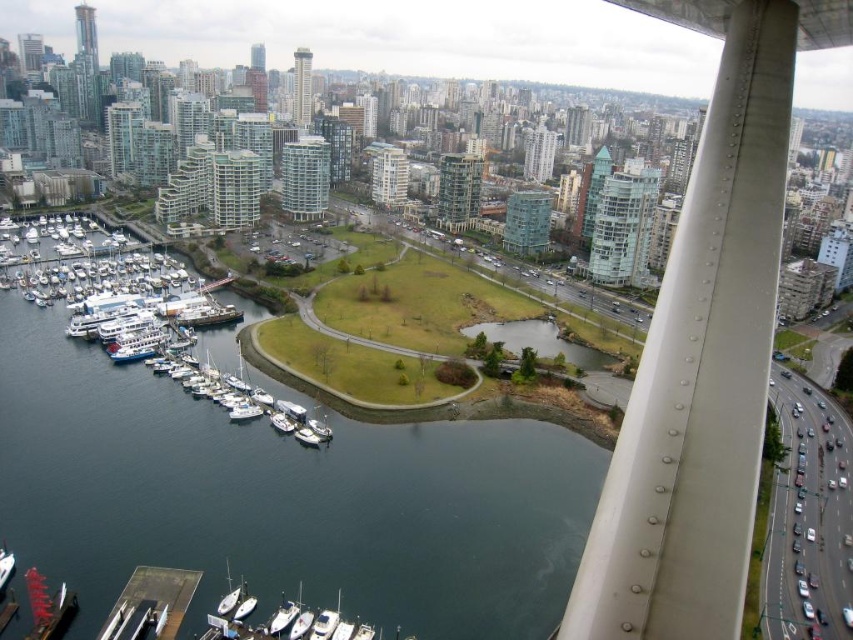
Does point (57, 493) come farther from viewer compared to point (311, 440)?

No.

Can you confirm if dark blue water at center is positioned below white matte boat at lower center?

Actually, dark blue water at center is above white matte boat at lower center.

Describe the element at coordinates (280, 497) in the screenshot. The image size is (853, 640). I see `dark blue water at center` at that location.

You are a GUI agent. You are given a task and a screenshot of the screen. Output one action in this format:
    pyautogui.click(x=<x>, y=<y>)
    Task: Click on the dark blue water at center
    The width and height of the screenshot is (853, 640).
    Given the screenshot: What is the action you would take?
    pyautogui.click(x=280, y=497)

Looking at this image, can you confirm if metallic gray dock at lower left is positioned above white matte sailboat at lower center?

Actually, metallic gray dock at lower left is below white matte sailboat at lower center.

Between metallic gray dock at lower left and white matte sailboat at lower center, which one has more height?

metallic gray dock at lower left

The image size is (853, 640). Find the location of `metallic gray dock at lower left`. metallic gray dock at lower left is located at coordinates (151, 604).

Between white matte boats at lower left and metallic gray dock at lower left, which one is positioned lower?

Positioned lower is metallic gray dock at lower left.

This screenshot has height=640, width=853. What do you see at coordinates (134, 307) in the screenshot?
I see `white matte boats at lower left` at bounding box center [134, 307].

This screenshot has width=853, height=640. Describe the element at coordinates (134, 307) in the screenshot. I see `white matte boats at lower left` at that location.

This screenshot has height=640, width=853. I want to click on white matte boats at lower left, so click(134, 307).